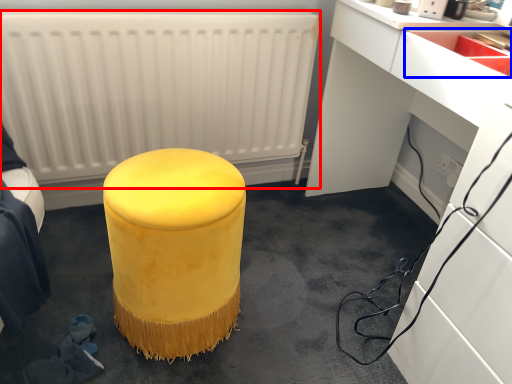
Question: Which of the following is the farthest to the observer, radiator (highlighted by a red box) or sink (highlighted by a blue box)?

Choices:
 (A) radiator
 (B) sink

Answer: (A)